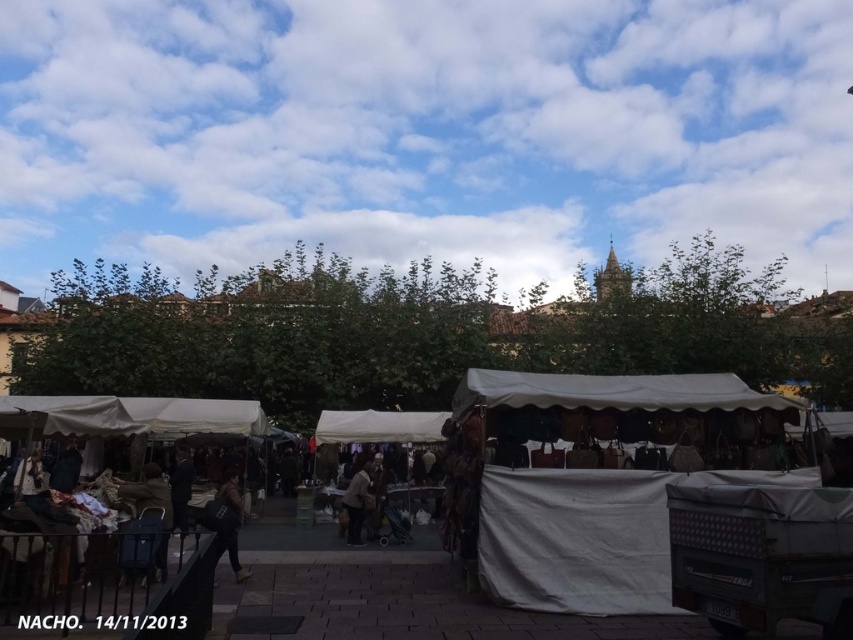
Is point (213, 500) positioned behind point (358, 515)?

No, it is in front of (358, 515).

Image resolution: width=853 pixels, height=640 pixels. I want to click on dark gray fabric jacket at lower center, so click(227, 522).

Who is taller, white fabric market stall at center or light brown fabric coat at center?

white fabric market stall at center is taller.

Is white fabric market stall at center positioned at the back of light brown fabric coat at center?

No, it is in front of light brown fabric coat at center.

Is point (688, 394) behind point (358, 492)?

No, (688, 394) is in front of (358, 492).

Where is `white fabric market stall at center`? Image resolution: width=853 pixels, height=640 pixels. white fabric market stall at center is located at coordinates (107, 580).

Which is more to the left, white fabric tent at center or white fabric market stall at center?

white fabric market stall at center is more to the left.

Is white fabric tent at center thinner than white fabric market stall at center?

Yes, white fabric tent at center is thinner than white fabric market stall at center.

Who is more distant from viewer, (526,456) or (0,598)?

Positioned behind is point (526,456).

Find the location of a particular element. white fabric tent at center is located at coordinates (604, 476).